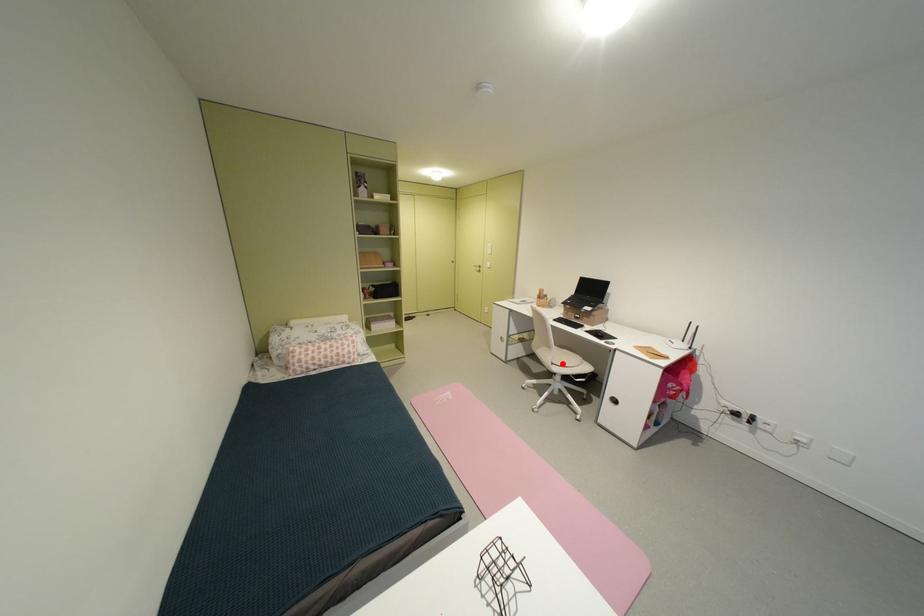
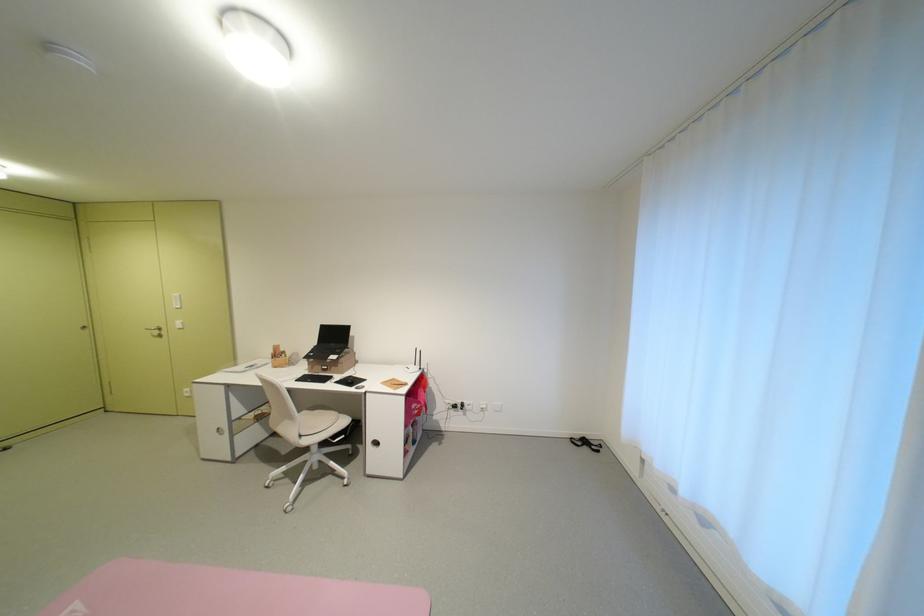
Question: I am providing you with two images of the same scene from different viewpoints. Given a red point in image1, look at the same physical point in image2. Is it:

Choices:
 (A) Closer to the viewpoint
 (B) Farther from the viewpoint

Answer: (B)